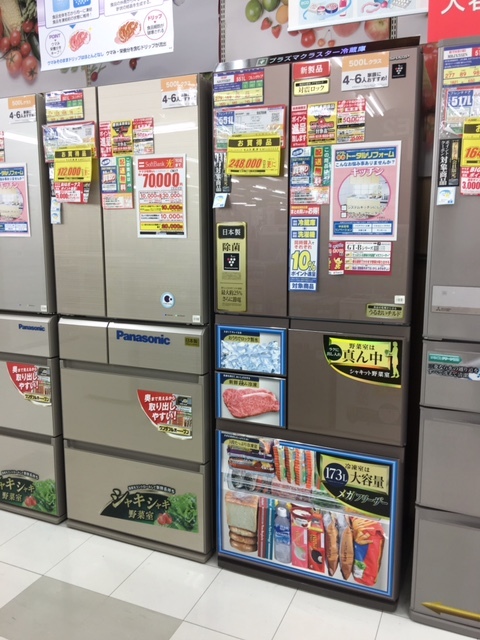
You are a GUI agent. You are given a task and a screenshot of the screen. Output one action in this format:
    pyautogui.click(x=<x>, y=<y>)
    Task: Click on the refrigerator
    The width and height of the screenshot is (480, 640).
    Given the screenshot: What is the action you would take?
    pyautogui.click(x=91, y=269), pyautogui.click(x=30, y=269), pyautogui.click(x=271, y=285), pyautogui.click(x=464, y=278)